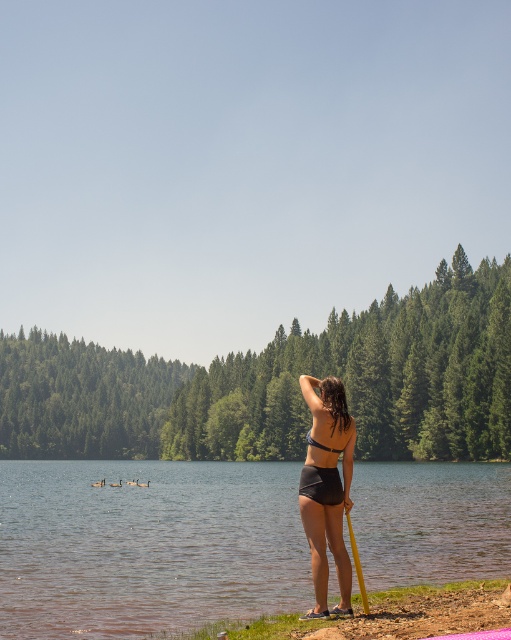
Between clear water at shore right and yellow plastic pole at lower center, which one appears on the right side from the viewer's perspective?

Positioned to the right is yellow plastic pole at lower center.

Which of these two, clear water at shore right or yellow plastic pole at lower center, stands shorter?

Standing shorter between the two is yellow plastic pole at lower center.

Is point (276, 465) farther from viewer compared to point (361, 600)?

Yes, it is behind point (361, 600).

This screenshot has height=640, width=511. I want to click on clear water at shore right, so click(147, 547).

Is matte black bikini at center further to the viewer compared to yellow plastic pole at lower center?

Yes.

Who is lower down, matte black bikini at center or yellow plastic pole at lower center?

matte black bikini at center is lower down.

Is point (323, 604) positioned in front of point (358, 580)?

Yes.

Identify the location of matte black bikini at center. (327, 488).

Does clear water at shore right appear on the left side of matte black bikini at center?

Indeed, clear water at shore right is positioned on the left side of matte black bikini at center.

Which is below, clear water at shore right or matte black bikini at center?

clear water at shore right is below.

You are a GUI agent. You are given a task and a screenshot of the screen. Output one action in this format:
    pyautogui.click(x=<x>, y=<y>)
    Task: Click on the clear water at shore right
    The image size is (511, 640).
    Given the screenshot: What is the action you would take?
    pyautogui.click(x=147, y=547)